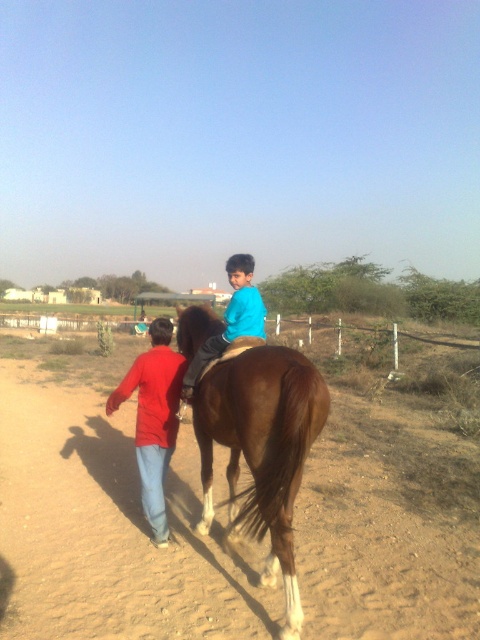
Question: Does brown glossy horse at center have a smaller size compared to blue matte shirt at center?

Choices:
 (A) yes
 (B) no

Answer: (A)

Question: Based on their relative distances, which object is nearer to the red cotton shirt at left?

Choices:
 (A) blue matte shirt at center
 (B) brown glossy horse at center

Answer: (A)

Question: Which is nearer to the brown glossy horse at center?

Choices:
 (A) blue matte shirt at center
 (B) red cotton shirt at left

Answer: (A)

Question: Which object is the closest to the red cotton shirt at left?

Choices:
 (A) brown glossy horse at center
 (B) brown dirt field at center
 (C) blue matte shirt at center

Answer: (C)

Question: Is red cotton shirt at left below blue matte shirt at center?

Choices:
 (A) no
 (B) yes

Answer: (B)

Question: Does brown glossy horse at center have a greater width compared to blue matte shirt at center?

Choices:
 (A) no
 (B) yes

Answer: (B)